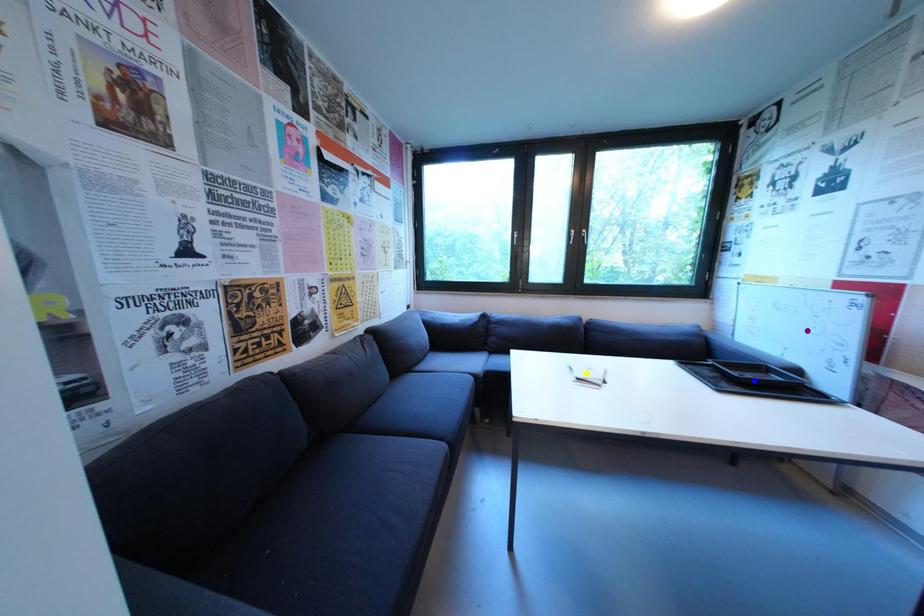
Order these from farthest to nearest:
yellow point, blue point, purple point

yellow point < blue point < purple point